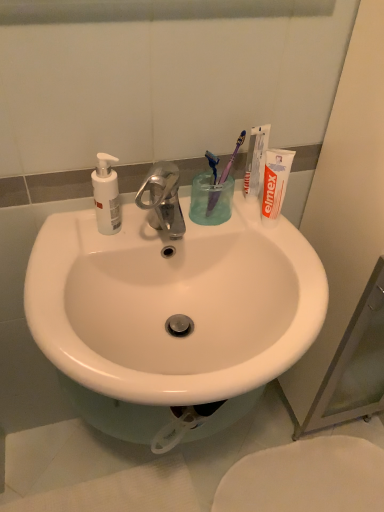
You are a GUI agent. You are given a task and a screenshot of the screen. Output one action in this format:
    pyautogui.click(x=<x>, y=<y>)
    Task: Click on the free space on the front side of white matte toothpaste at upper right
    
    Given the screenshot: What is the action you would take?
    pyautogui.click(x=268, y=238)